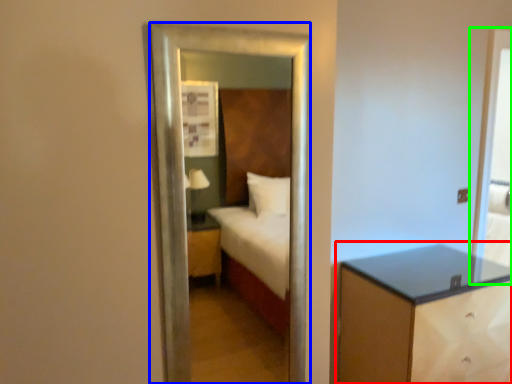
Question: Which is nearer to the nightstand (highlighted by a red box)? mirror (highlighted by a blue box) or screen door (highlighted by a green box).

Choices:
 (A) mirror
 (B) screen door

Answer: (B)